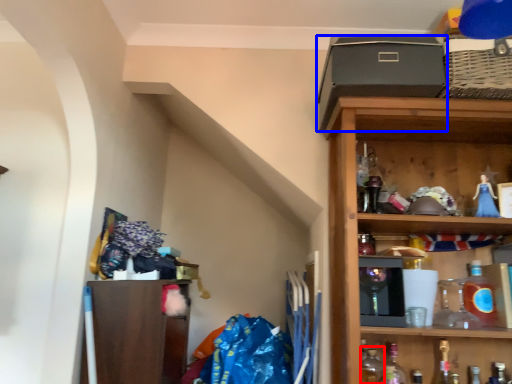
Question: Which point is closer to the camera, bottle (highlighted by a red box) or box (highlighted by a blue box)?

Choices:
 (A) bottle
 (B) box

Answer: (B)